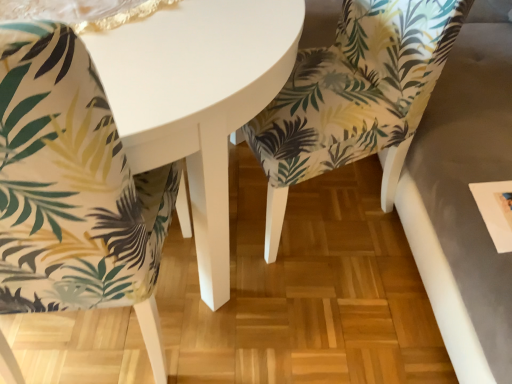
Question: Is palm-patterned fabric chair at lower left, arranged as the first chair when viewed from the left, located outside white glossy table at center?

Choices:
 (A) no
 (B) yes

Answer: (A)

Question: Is palm-patterned fabric chair at lower left, marked as the 2th chair in a right-to-left arrangement, at the left side of white glossy table at center?

Choices:
 (A) no
 (B) yes

Answer: (A)

Question: Can you confirm if palm-patterned fabric chair at lower left, arranged as the first chair when viewed from the left, is positioned to the right of white glossy table at center?

Choices:
 (A) no
 (B) yes

Answer: (B)

Question: From the image's perspective, is palm-patterned fabric chair at lower left, arranged as the first chair when viewed from the left, located beneath white glossy table at center?

Choices:
 (A) no
 (B) yes

Answer: (B)

Question: Can you confirm if palm-patterned fabric chair at lower left, arranged as the first chair when viewed from the left, is thinner than white glossy table at center?

Choices:
 (A) no
 (B) yes

Answer: (B)

Question: From a real-world perspective, does palm-patterned fabric chair at lower left, arranged as the first chair when viewed from the left, stand above white glossy table at center?

Choices:
 (A) yes
 (B) no

Answer: (A)

Question: Can you confirm if printed fabric chair at center, marked as the second chair in a left-to-right arrangement, is shorter than palm-patterned fabric chair at lower left, marked as the 2th chair in a right-to-left arrangement?

Choices:
 (A) no
 (B) yes

Answer: (B)

Question: From the image's perspective, would you say printed fabric chair at center, which is the 1th chair from right to left, is positioned over palm-patterned fabric chair at lower left, marked as the 2th chair in a right-to-left arrangement?

Choices:
 (A) no
 (B) yes

Answer: (B)

Question: Is printed fabric chair at center, which is the 1th chair from right to left, located outside palm-patterned fabric chair at lower left, marked as the 2th chair in a right-to-left arrangement?

Choices:
 (A) no
 (B) yes

Answer: (B)

Question: Is printed fabric chair at center, which is the 1th chair from right to left, further to the viewer compared to palm-patterned fabric chair at lower left, marked as the 2th chair in a right-to-left arrangement?

Choices:
 (A) no
 (B) yes

Answer: (B)

Question: Is printed fabric chair at center, which is the 1th chair from right to left, at the left side of palm-patterned fabric chair at lower left, marked as the 2th chair in a right-to-left arrangement?

Choices:
 (A) no
 (B) yes

Answer: (A)

Question: From a real-world perspective, is printed fabric chair at center, marked as the second chair in a left-to-right arrangement, on palm-patterned fabric chair at lower left, marked as the 2th chair in a right-to-left arrangement?

Choices:
 (A) no
 (B) yes

Answer: (A)

Question: Can you confirm if white glossy table at center is positioned to the left of printed fabric chair at center, which is the 1th chair from right to left?

Choices:
 (A) no
 (B) yes

Answer: (B)